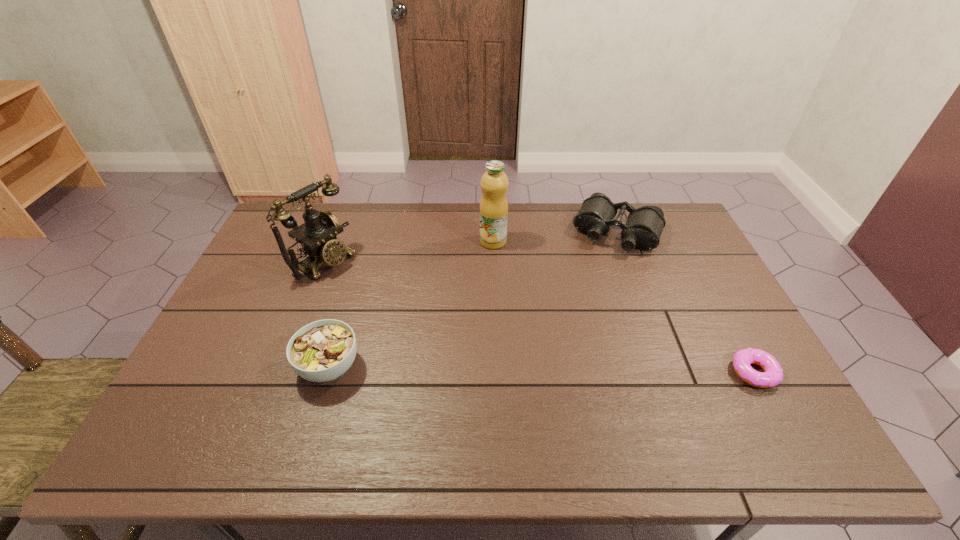
Identify the location of blank area located 0.070m on the front label of the fruit juice. The width and height of the screenshot is (960, 540). pos(507,262).

This screenshot has width=960, height=540. I want to click on free space located 0.180m on the front label of the fruit juice, so click(x=520, y=284).

Where is `free space located 0.390m on the front label of the fruit juice`? This screenshot has height=540, width=960. free space located 0.390m on the front label of the fruit juice is located at coordinates click(x=552, y=332).

Where is `vacant area located on the rotary dial of the telephone`? Image resolution: width=960 pixels, height=540 pixels. vacant area located on the rotary dial of the telephone is located at coordinates (405, 313).

Find the location of `vacant space located on the rotary dial of the telephone`. vacant space located on the rotary dial of the telephone is located at coordinates (430, 329).

Locate an element on the screen. The width and height of the screenshot is (960, 540). free space located on the rotary dial of the telephone is located at coordinates (407, 315).

Where is `binoculars at the far edge`? The height and width of the screenshot is (540, 960). binoculars at the far edge is located at coordinates (643, 229).

You are a GUI agent. You are given a task and a screenshot of the screen. Output one action in this format:
    pyautogui.click(x=<x>, y=<y>)
    Task: Click on the fruit juice positioned at the far edge
    Image resolution: width=960 pixels, height=540 pixels.
    Given the screenshot: What is the action you would take?
    pyautogui.click(x=494, y=183)

Identify the location of telephone at the far edge. (317, 236).

The width and height of the screenshot is (960, 540). I want to click on soup bowl at the near edge, so click(321, 351).